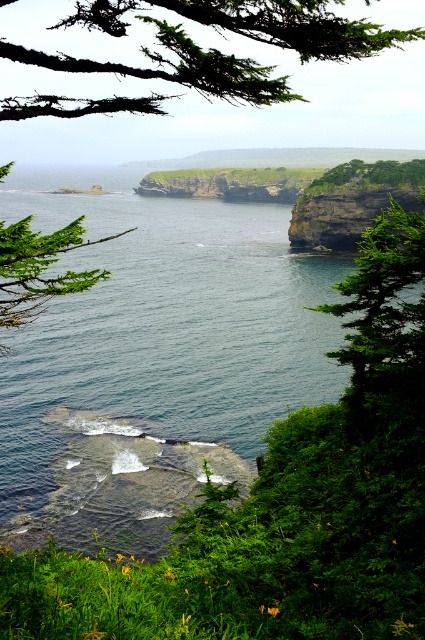
Who is more distant from viewer, [90,28] or [11,294]?

Point [90,28]

Is green mossy branch at upper left further to the viewer compared to green leafy tree at left?

No.

Locate an element on the screen. green mossy branch at upper left is located at coordinates (217, 49).

Where is `green mossy branch at upper left`? green mossy branch at upper left is located at coordinates (217, 49).

Can you confirm if green water at center is positioned to the left of green leafy tree at left?

In fact, green water at center is to the right of green leafy tree at left.

Identify the location of green water at center. (155, 360).

Where is `green leafy tree at right`? This screenshot has height=640, width=425. green leafy tree at right is located at coordinates (385, 328).

Can you confirm if green leafy tree at right is positioned below green leafy tree at upper center?

Yes, green leafy tree at right is below green leafy tree at upper center.

Locate an element on the screen. The width and height of the screenshot is (425, 640). green leafy tree at right is located at coordinates (385, 328).

At what (x,y) coordinates should I click in order to perform the action: click on green leafy tree at right. Please return your answer as a coordinate pair (x, y). This screenshot has height=640, width=425. Looking at the image, I should click on (385, 328).